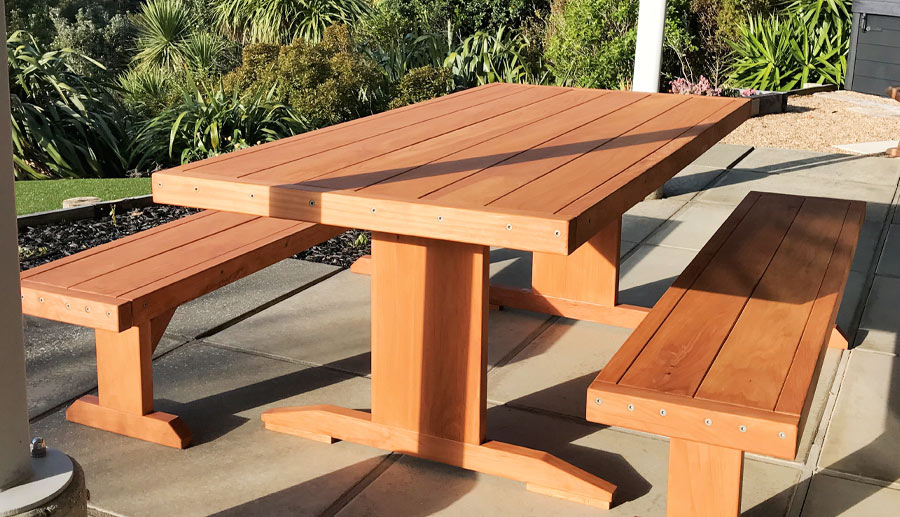
This screenshot has height=517, width=900. Find the location of `left bench`. left bench is located at coordinates (147, 246).